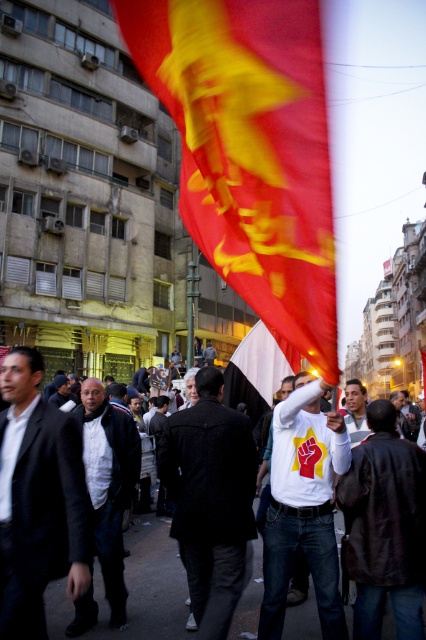
Who is more forward, (241,472) or (85,612)?

Point (85,612) is more forward.

This screenshot has width=426, height=640. I want to click on black textured coat at center, so click(210, 499).

Is point (212, 419) positioned in front of point (115, 490)?

Yes.

This screenshot has width=426, height=640. Find the location of `black textured coat at center`. black textured coat at center is located at coordinates (210, 499).

Is black matte jacket at center wider than white matte flag at center?

No.

Between black matte jacket at center and white matte flag at center, which one appears on the right side from the viewer's perspective?

white matte flag at center

Describe the element at coordinates (109, 483) in the screenshot. I see `black matte jacket at center` at that location.

This screenshot has height=640, width=426. Identify the location of black matte jacket at center. (109, 483).

Is black textured coat at center wider than white matte t-shirt at center?

Incorrect, black textured coat at center's width does not surpass white matte t-shirt at center's.

Does point (189, 444) come farther from viewer compared to point (340, 461)?

Yes, point (189, 444) is farther from viewer.

Is point (213, 371) less distant than point (333, 452)?

No, it is not.

The height and width of the screenshot is (640, 426). I want to click on black textured coat at center, so click(x=210, y=499).